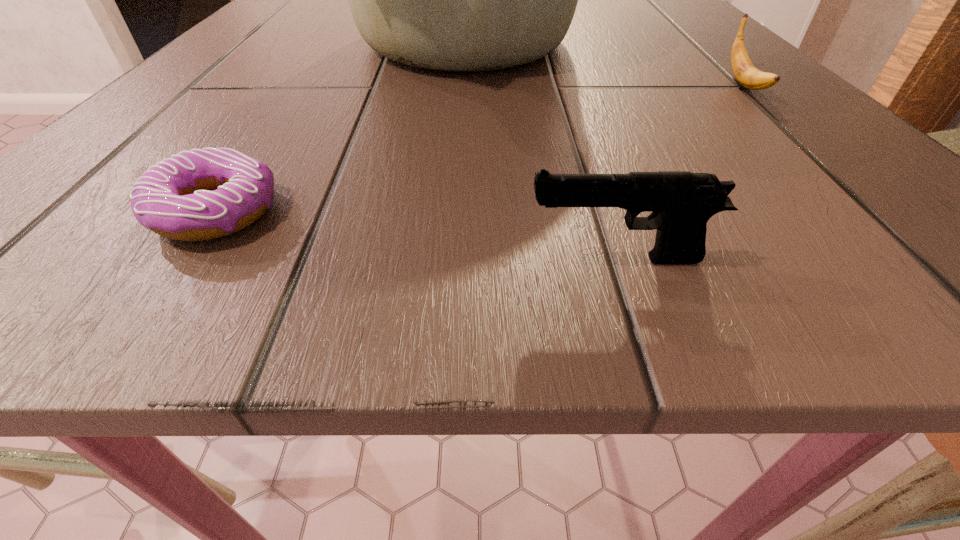
Locate an element on the screen. This screenshot has width=960, height=540. object located in the far edge section of the desktop is located at coordinates (461, 0).

The width and height of the screenshot is (960, 540). I want to click on pistol positioned at the near edge, so click(x=681, y=202).

Image resolution: width=960 pixels, height=540 pixels. In order to click on doughnut that is at the near edge in this screenshot , I will do `click(174, 199)`.

Where is `object at the left edge`? object at the left edge is located at coordinates (174, 199).

You are a GUI agent. You are given a task and a screenshot of the screen. Output one action in this format:
    pyautogui.click(x=<x>, y=<y>)
    Task: Click on the object present at the right edge
    The image size is (960, 540).
    Given the screenshot: What is the action you would take?
    pyautogui.click(x=746, y=74)

Locate an element on the screen. The width and height of the screenshot is (960, 540). object present at the near left corner is located at coordinates (174, 199).

Where is `free space at the far edge of the desktop`? This screenshot has width=960, height=540. free space at the far edge of the desktop is located at coordinates (578, 3).

You are a GUI agent. You are given a task and a screenshot of the screen. Output one action in this format:
    pyautogui.click(x=<x>, y=<y>)
    Task: Click on the vacant space at the near edge of the desktop
    This screenshot has height=540, width=960.
    Given the screenshot: What is the action you would take?
    pyautogui.click(x=738, y=233)

What are the coordinates of `free space at the left edge of the desktop` in the screenshot? It's located at (191, 145).

Find the location of a particular element. This screenshot has height=540, width=960. vacant space at the right edge of the desktop is located at coordinates (727, 43).